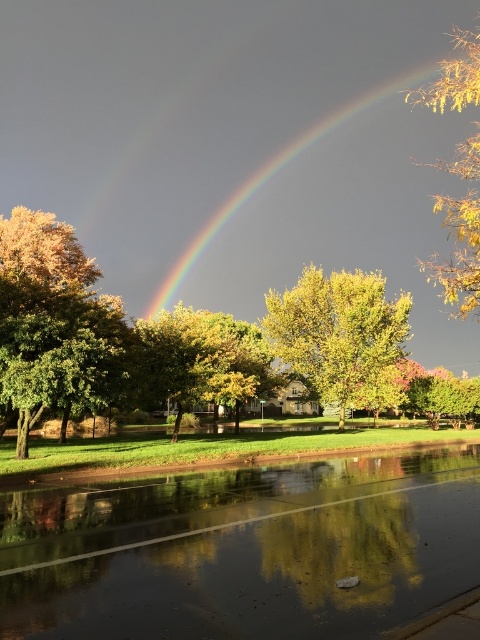
Measure the distance between point (61, 260) and camera.

Point (61, 260) and camera are 91.58 feet apart.

Is point (72, 364) more distant than point (325, 401)?

No, (72, 364) is in front of (325, 401).

What do you see at coordinates (50, 321) in the screenshot? The image size is (480, 640). I see `golden yellow leaves at left` at bounding box center [50, 321].

Locate an element on the screen. This screenshot has width=480, height=640. golden yellow leaves at left is located at coordinates (50, 321).

Can you confirm if glossy asphalt flood at lower center is positioned below rainbow at center?

Indeed, glossy asphalt flood at lower center is positioned under rainbow at center.

Is glossy asphalt flood at lower center thinner than rainbow at center?

Indeed, glossy asphalt flood at lower center has a lesser width compared to rainbow at center.

Where is `glossy asphalt flood at lower center`? glossy asphalt flood at lower center is located at coordinates (243, 550).

Between glossy asphalt flood at lower center and yellow leafy tree at upper right, which one is positioned lower?

Positioned lower is glossy asphalt flood at lower center.

Is glossy asphalt flood at lower center taller than yellow leafy tree at upper right?

Incorrect, glossy asphalt flood at lower center's height is not larger of yellow leafy tree at upper right's.

Which is behind, point (229, 580) or point (463, 74)?

Point (463, 74)

Locate an element on the screen. This screenshot has height=640, width=480. glossy asphalt flood at lower center is located at coordinates (243, 550).